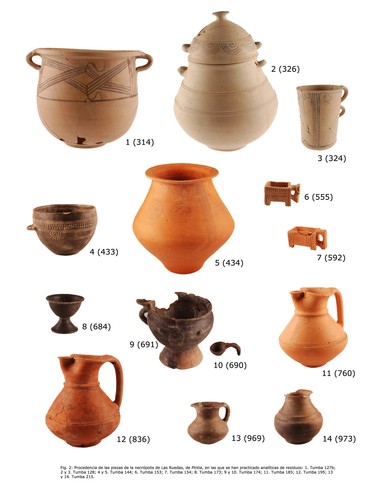
Locate an element on the screen. This screenshot has height=500, width=376. dark orange pitcher is located at coordinates (83, 405).